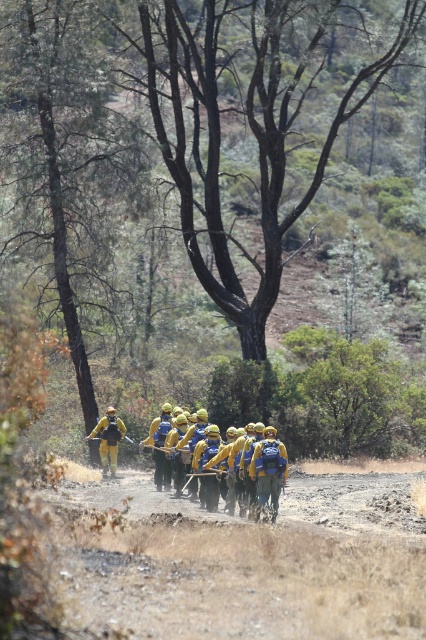
You are a drone operator trying to locate a specific point in a forest. The firefighters are walking in a single file line along a dirt path. According to the coordinates provided, where would you direct the drone to focus its camera to find the yellow fabric uniform at center?

The yellow fabric uniform at center is located at coordinates point (x=265, y=465), so direct the drone to focus its camera there to find it.

From the picture: You are a firefighter in the group depicted in the image. You notice a point marked at coordinates (x=265, y=465). What object does this point correspond to?

The point at coordinates (x=265, y=465) corresponds to the yellow fabric uniform at center.

You are a park ranger assessing the visibility of firefighters in the forest. You notice two firefighters wearing different uniforms at the center of the image. Which uniform, the yellow fabric uniform at center or the yellow reflective uniform at center, would likely be easier to spot from a distance?

The yellow reflective uniform at center is taller than the yellow fabric uniform at center, making it more visible from a distance due to its increased height.